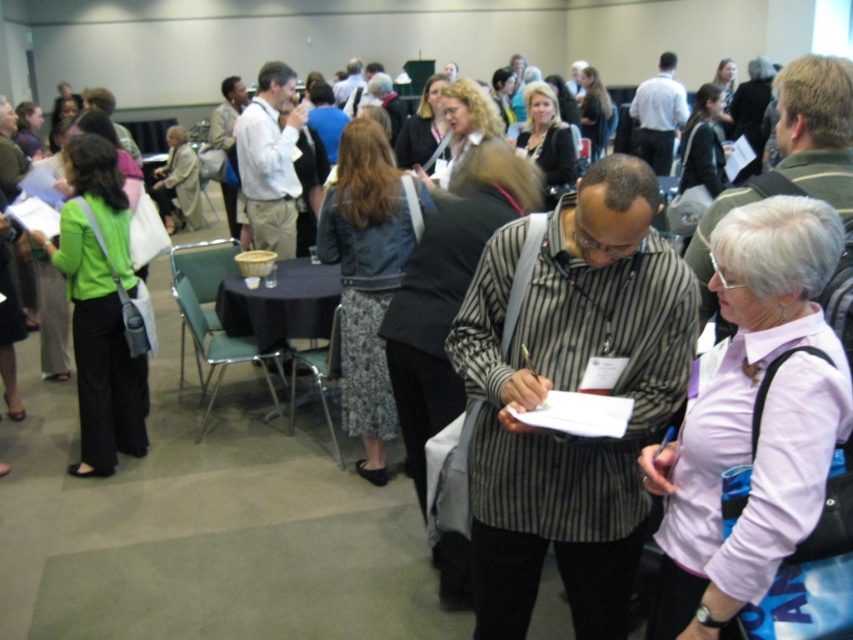
Question: Among these objects, which one is nearest to the camera?

Choices:
 (A) striped shirt at center
 (B) light beige cotton shirt at center
 (C) white shirt at center
 (D) striped cotton shirt at center

Answer: (D)

Question: Among these objects, which one is nearest to the camera?

Choices:
 (A) white shirt at center
 (B) light beige cotton shirt at center
 (C) striped shirt at center
 (D) striped cotton shirt at center

Answer: (D)

Question: Does striped cotton shirt at center have a greater width compared to striped shirt at center?

Choices:
 (A) yes
 (B) no

Answer: (A)

Question: Is striped cotton shirt at center positioned in front of white shirt at center?

Choices:
 (A) yes
 (B) no

Answer: (A)

Question: Where is striped cotton shirt at center located in relation to light beige cotton shirt at center in the image?

Choices:
 (A) below
 (B) above

Answer: (A)

Question: Which object is positioned farthest from the white shirt at center?

Choices:
 (A) striped shirt at center
 (B) light beige cotton shirt at center
 (C) striped cotton shirt at center

Answer: (C)